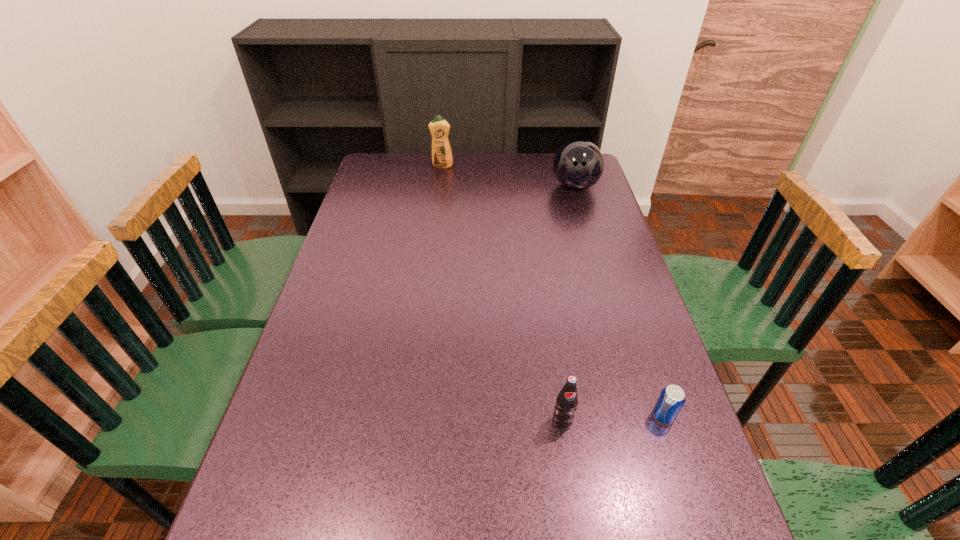
This screenshot has width=960, height=540. I want to click on detergent at the far edge, so click(439, 128).

Where is `bowling ball that is at the far edge`? The height and width of the screenshot is (540, 960). bowling ball that is at the far edge is located at coordinates (578, 165).

Where is `bowling ball at the right edge`? The image size is (960, 540). bowling ball at the right edge is located at coordinates (578, 165).

The height and width of the screenshot is (540, 960). What are the coordinates of `beer can that is at the right edge` in the screenshot? It's located at (672, 398).

I want to click on object that is at the far right corner, so click(x=578, y=165).

In the image, there is a desktop. Where is `vacant space at the far edge`? The height and width of the screenshot is (540, 960). vacant space at the far edge is located at coordinates (418, 173).

In the image, there is a desktop. Where is `free region at the left edge`? Image resolution: width=960 pixels, height=540 pixels. free region at the left edge is located at coordinates (377, 222).

The image size is (960, 540). In order to click on free spot at the right edge of the desktop in this screenshot , I will do `click(594, 227)`.

This screenshot has height=540, width=960. Find the location of `free space at the far left corner of the desktop`. free space at the far left corner of the desktop is located at coordinates (371, 170).

What are the coordinates of `vacant area between the third object from right to left and the beer can` in the screenshot? It's located at pos(612,418).